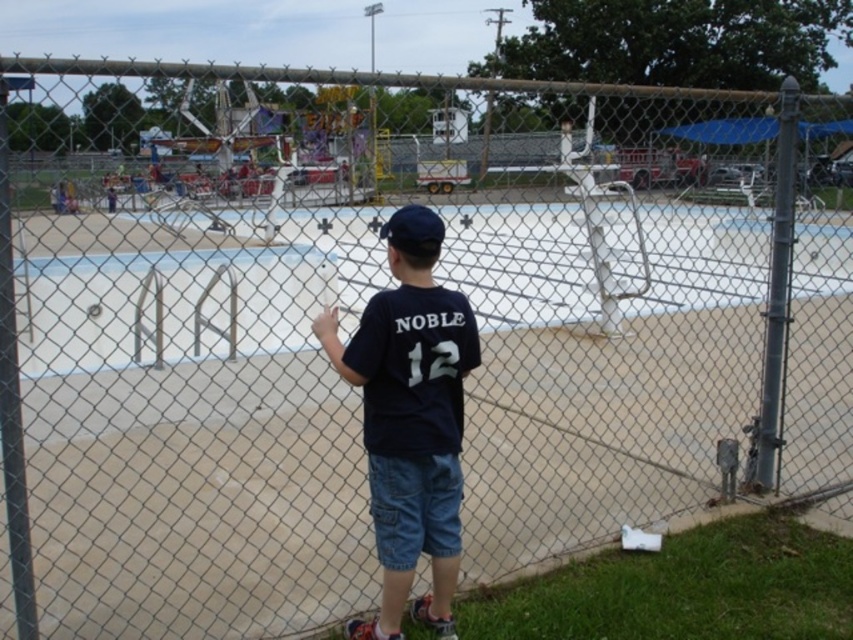
The boy is standing behind a chain link fence looking at the skate park. There is a point marked at coordinates (410, 419). Which object from the scene does this point belong to?

The point at coordinates (410, 419) is on the dark blue T shirt at center.